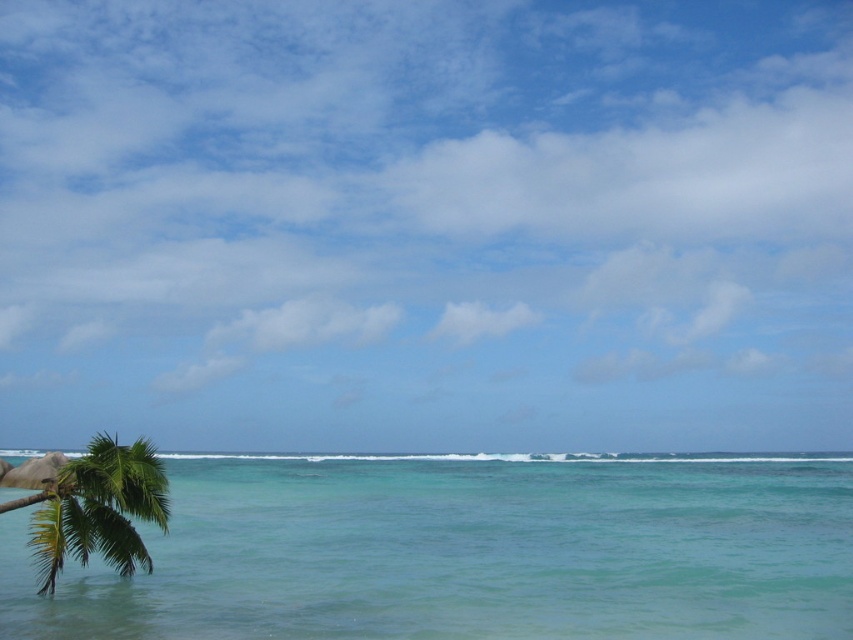
You are standing on a sandy beach and looking at the turquoise glossy water at center and the green leafy palm tree at lower left. Which object is closer to the bottom edge of the image?

The green leafy palm tree at lower left is closer to the bottom edge of the image because it is positioned lower than the turquoise glossy water at center.

You are a drone operator trying to capture the best aerial shot of the turquoise glossy water at center. The drone is currently hovering at point (467, 550). Is the drone positioned over the turquoise glossy water at center?

Yes, the drone is positioned over the turquoise glossy water at center as the point (467, 550) indicates that location.

You are a drone operator trying to capture the perfect shot of the turquoise glossy water at center. The drone must hover exactly above the water to avoid obstructing the view. Given the coordinates provided, can you confirm if the drone is positioned correctly?

The turquoise glossy water at center is located at point (467,550), so yes, the drone can hover above that coordinate to capture the perfect shot without obstruction.